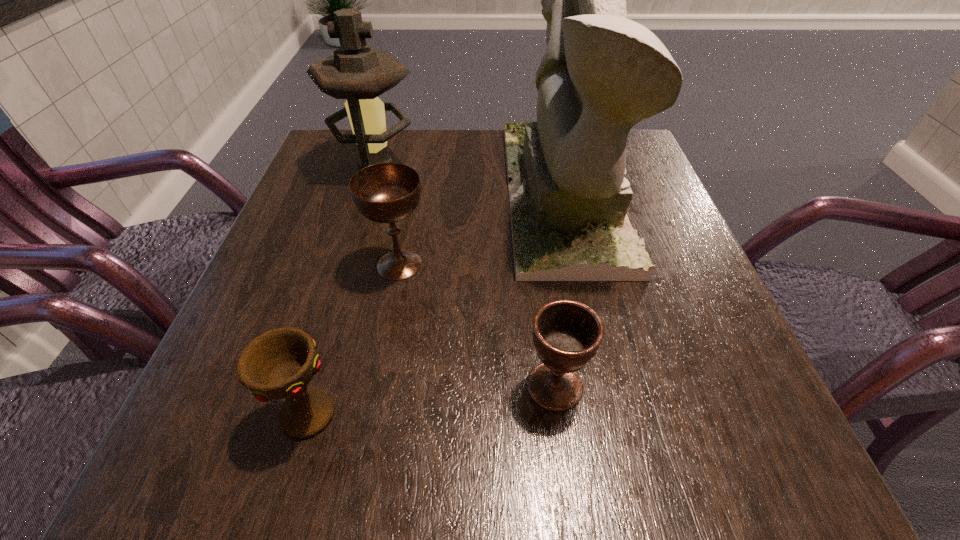
At what (x,y) coordinates should I click in order to perform the action: click on vacant region at the far edge of the desktop. Please return your answer as a coordinate pair (x, y). This screenshot has height=540, width=960. Looking at the image, I should click on (499, 174).

Find the location of a particular element. This screenshot has width=960, height=540. vacant space at the near edge of the desktop is located at coordinates (364, 450).

You are a GUI agent. You are given a task and a screenshot of the screen. Output one action in this format:
    pyautogui.click(x=<x>, y=<y>)
    Task: Click on the free space at the left edge of the desktop
    
    Given the screenshot: What is the action you would take?
    pyautogui.click(x=327, y=341)

In the image, there is a desktop. At what (x,y) coordinates should I click in order to perform the action: click on vacant space at the right edge. Please return your answer as a coordinate pair (x, y). Looking at the image, I should click on (636, 319).

I want to click on vacant space at the far left corner, so click(327, 184).

The height and width of the screenshot is (540, 960). I want to click on vacant point at the near right corner, so click(x=772, y=484).

What are the coordinates of `unoccupied position between the farthest chalice and the rightmost chalice` in the screenshot? It's located at (477, 326).

What are the coordinates of `free area in between the rightmost chalice and the second tallest object` in the screenshot? It's located at (466, 276).

Locate an element on the screen. vacant region between the sculpture and the rightmost chalice is located at coordinates (559, 290).

The width and height of the screenshot is (960, 540). What are the coordinates of `vacant point located between the tallest chalice and the rightmost chalice` in the screenshot? It's located at (477, 326).